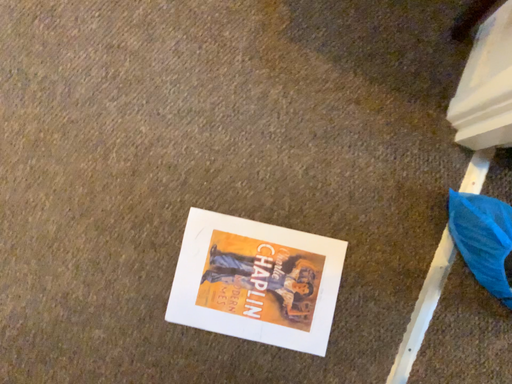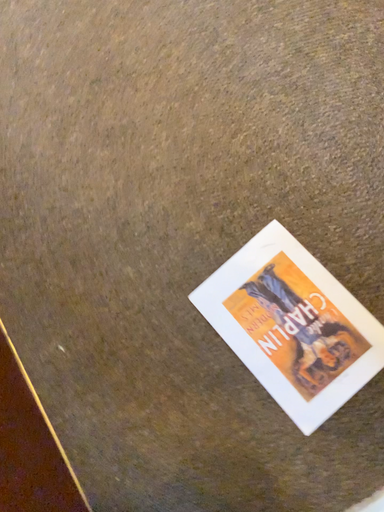
Question: Which way did the camera rotate in the video?

Choices:
 (A) rotated upward
 (B) rotated downward

Answer: (A)